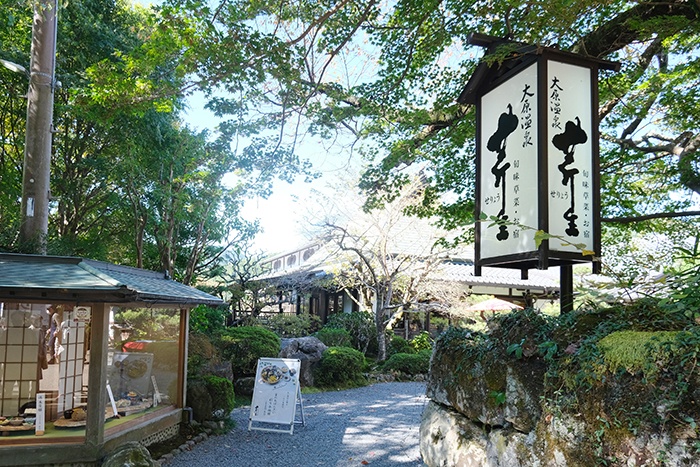
Find the location of `hung up wood sign`. hung up wood sign is located at coordinates (573, 97).